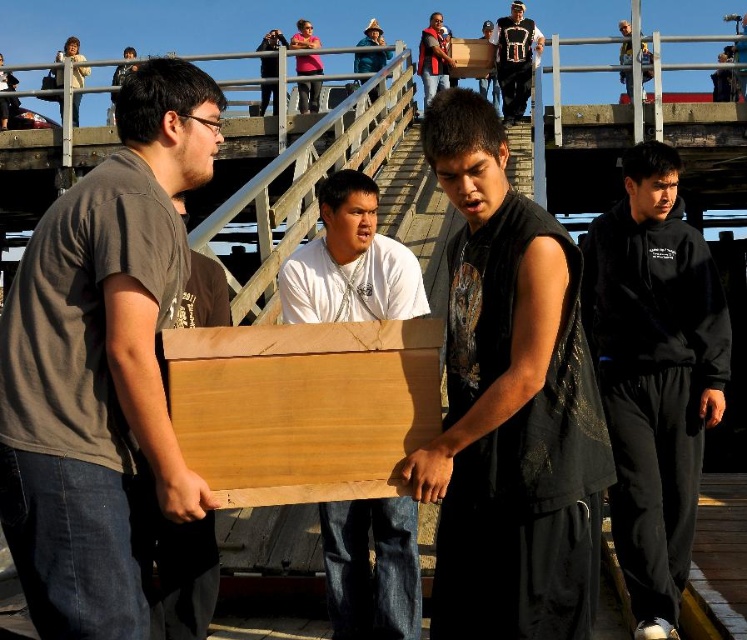
Question: Can you confirm if wooden board at center is wider than matte black shirt at center?

Choices:
 (A) yes
 (B) no

Answer: (A)

Question: Which of the following is the closest to the observer?

Choices:
 (A) (630, 192)
 (B) (37, 380)
 (C) (359, 72)
 (D) (260, 113)

Answer: (B)

Question: Is matte brown wood box at left below denim jacket at upper center?

Choices:
 (A) yes
 (B) no

Answer: (A)

Question: Is black sleeveless shirt at center to the right of matte black shirt at center from the viewer's perspective?

Choices:
 (A) no
 (B) yes

Answer: (A)

Question: Which of the following is the closest to the observer?

Choices:
 (A) black sleeveless shirt at center
 (B) matte black vest at upper center

Answer: (A)

Question: Which point is farther to the camera?

Choices:
 (A) light brown wood at upper right
 (B) matte brown wood box at left
 (C) denim jacket at upper center
 (D) black matte sweatshirt at right

Answer: (C)